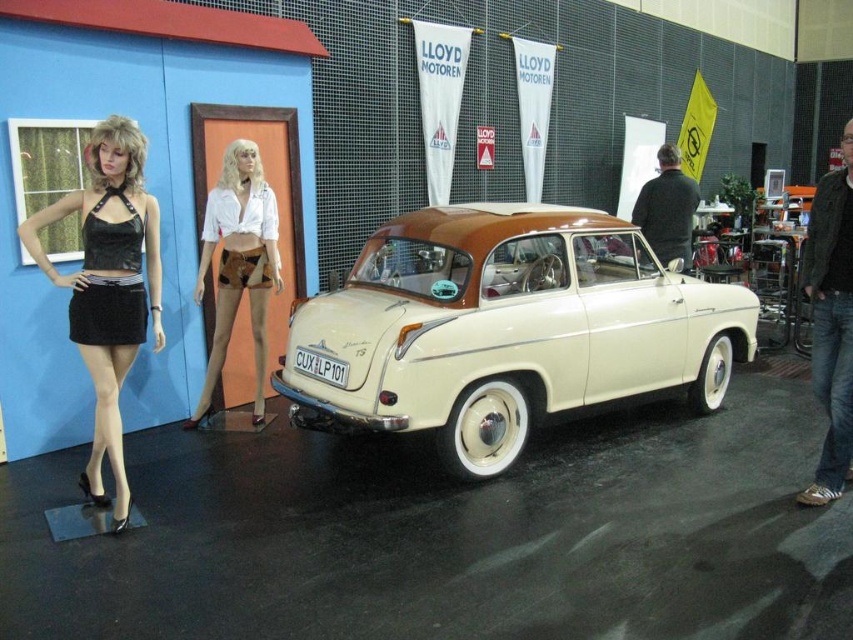
Is beige glossy car at center wider than brown suede shorts at center?

Yes.

Is point (374, 397) in front of point (227, 218)?

Yes, it is in front of point (227, 218).

Identify the location of beige glossy car at center. (508, 328).

Which of these two, brown suede shorts at center or white metallic license plate at center, stands taller?

Standing taller between the two is brown suede shorts at center.

Based on the photo, measure the distance between brown suede shorts at center and camera.

A distance of 4.87 meters exists between brown suede shorts at center and camera.

You are a GUI agent. You are given a task and a screenshot of the screen. Output one action in this format:
    pyautogui.click(x=<x>, y=<y>)
    Task: Click on the brown suede shorts at center
    
    Given the screenshot: What is the action you would take?
    pyautogui.click(x=239, y=264)

Does black satin miniskirt at left appear on the right side of black leather miniskirt at center?

Incorrect, black satin miniskirt at left is not on the right side of black leather miniskirt at center.

Does black satin miniskirt at left have a lesser height compared to black leather miniskirt at center?

No, black satin miniskirt at left is not shorter than black leather miniskirt at center.

Describe the element at coordinates (108, 310) in the screenshot. The image size is (853, 640). I see `black satin miniskirt at left` at that location.

Where is `black satin miniskirt at left`? black satin miniskirt at left is located at coordinates (108, 310).